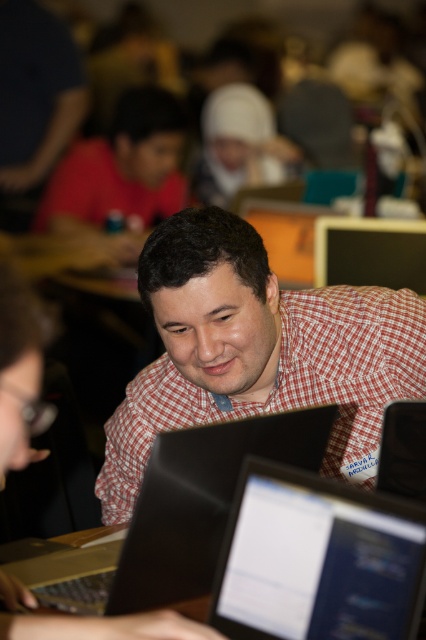
Does red checkered shirt at center appear on the left side of matte black monitor at upper center?

Indeed, red checkered shirt at center is positioned on the left side of matte black monitor at upper center.

From the picture: Measure the distance from red checkered shirt at center to matte black monitor at upper center.

92.23 centimeters

What do you see at coordinates (256, 349) in the screenshot?
I see `red checkered shirt at center` at bounding box center [256, 349].

Where is `red checkered shirt at center`? This screenshot has height=640, width=426. red checkered shirt at center is located at coordinates (256, 349).

Is matte black laptop at center wider than matte black monitor at upper center?

Incorrect, matte black laptop at center's width does not surpass matte black monitor at upper center's.

What do you see at coordinates (317, 561) in the screenshot? The height and width of the screenshot is (640, 426). I see `matte black laptop at center` at bounding box center [317, 561].

Who is more forward, (414, 515) or (362, 282)?

Point (414, 515) is more forward.

At what (x,y) coordinates should I click in order to perform the action: click on matte black laptop at center. Please return your answer as a coordinate pair (x, y). This screenshot has height=640, width=426. Looking at the image, I should click on (317, 561).

Does black matte laptop at center have a lesser height compared to matte red shirt at upper left?

Yes, black matte laptop at center is shorter than matte red shirt at upper left.

Does black matte laptop at center appear under matte red shirt at upper left?

Yes, black matte laptop at center is below matte red shirt at upper left.

Between point (192, 520) and point (112, 196), which one is positioned in front?

Point (192, 520)

Where is `black matte laptop at center`? Image resolution: width=426 pixels, height=640 pixels. black matte laptop at center is located at coordinates (204, 499).